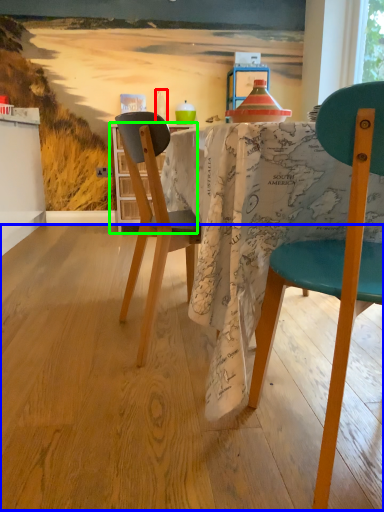
Question: Which object is positioned closest to bottle (highlighted by a red box)? Select from plywood (highlighted by a blue box) and kitchen & dining room table (highlighted by a green box).

Choices:
 (A) plywood
 (B) kitchen & dining room table

Answer: (B)